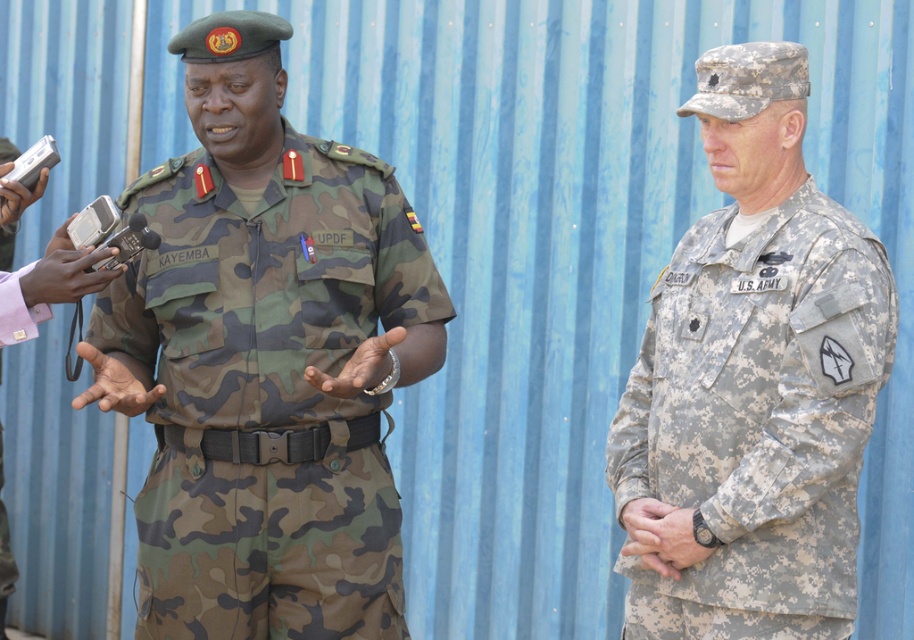
You are standing at point [303,509] and need to move to the nearest wall. The nearest wall is 10.86 feet away from you. Can you reach the wall without moving more than 10 feet?

Yes, the nearest wall is 10.86 feet away from you at point [303,509], so moving 10 feet would get you close but not quite there. However, since the question allows moving up to 10 feet, you can reach within 10 feet but not exactly at the wall.

Consider the image. You are a photographer taking a photo of two military personnel. You notice the camo fabric uniform at center and the camouflage fabric us army uniform at right. Which one is closer to the camera?

The camo fabric uniform at center is closer to the camera since it is in front of the camouflage fabric us army uniform at right.